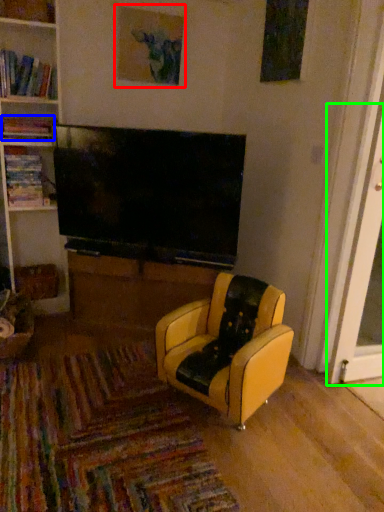
Question: Which is farther away from picture frame (highlighted by a red box)? book (highlighted by a blue box) or screen door (highlighted by a green box)?

Choices:
 (A) book
 (B) screen door

Answer: (B)